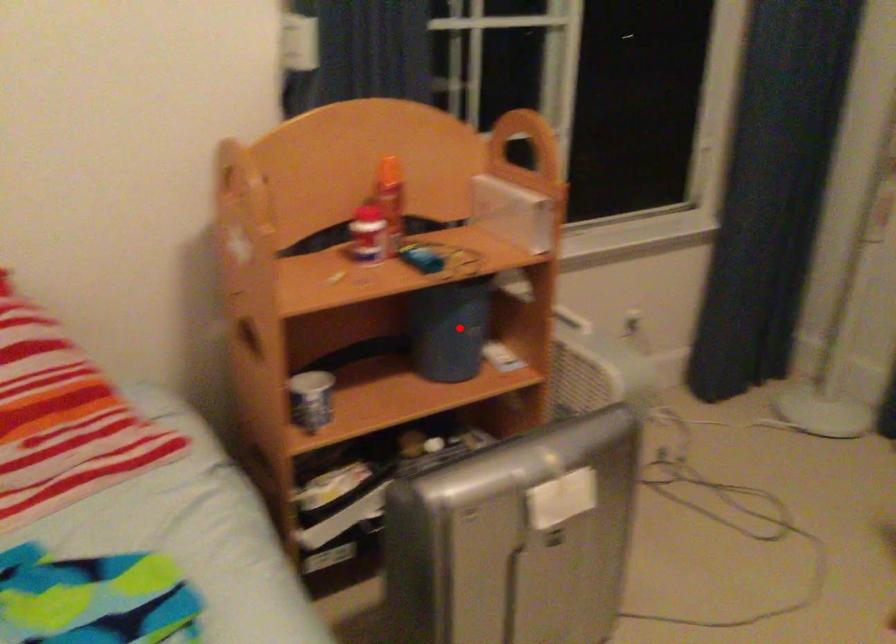
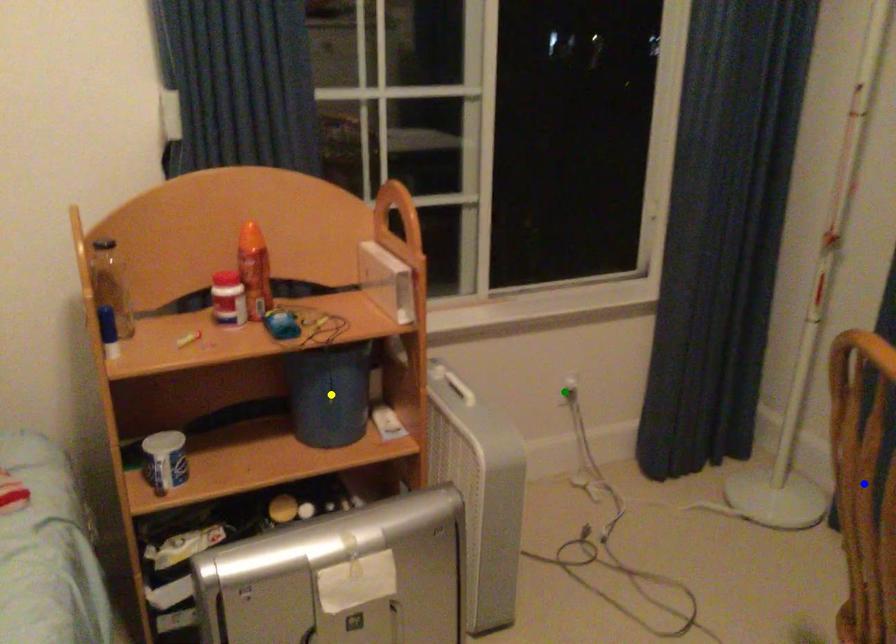
Question: I am providing you with two images of the same scene from different viewpoints. A red point is marked on the first image. You are given multiple points on the second image. Which point in image 2 is actually the same real-world point as the red point in image 1?

Choices:
 (A) yellow point
 (B) green point
 (C) blue point

Answer: (A)